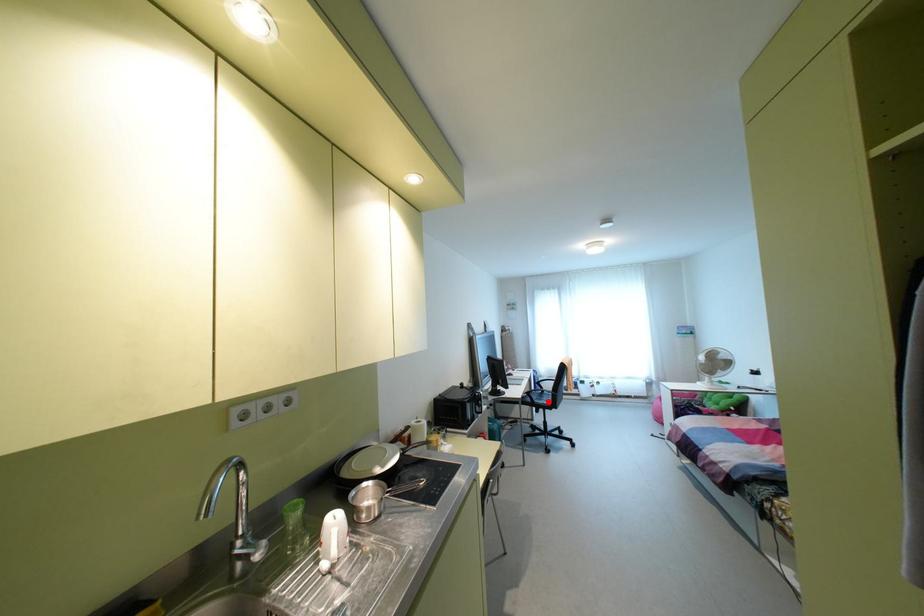
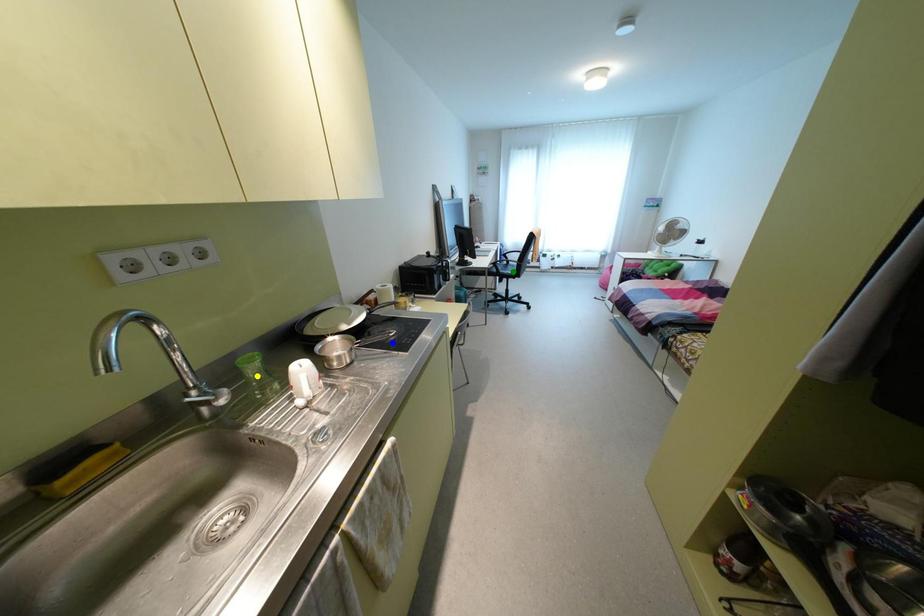
Question: I am providing you with two images of the same scene from different viewpoints. A red point is marked on the first image. You are given multiple points on the second image. Which point in image 2 is actually the same real-world point as the red point in image 1?

Choices:
 (A) green point
 (B) yellow point
 (C) blue point

Answer: (A)